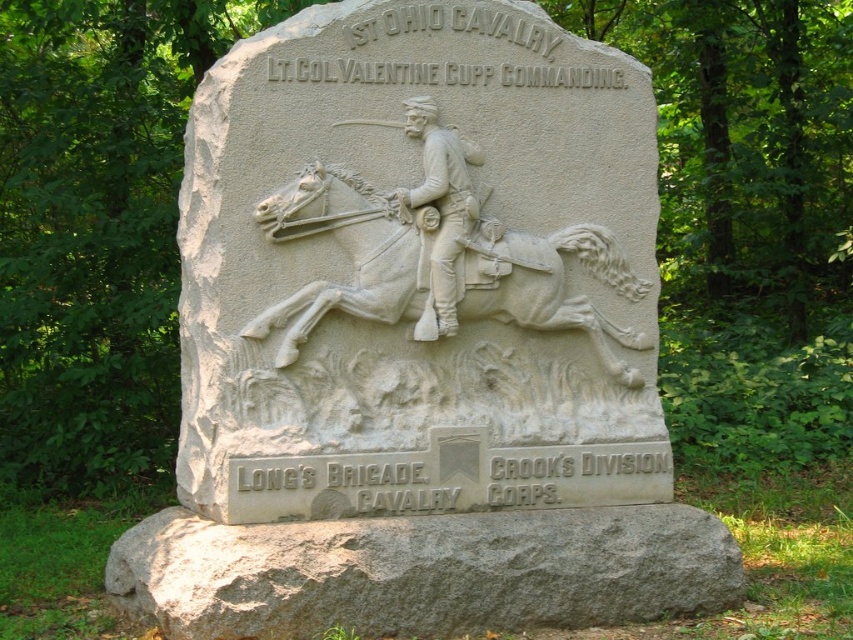
Is point (592, 240) positioned behind point (428, 99)?

Yes, point (592, 240) is behind point (428, 99).

Who is higher up, white stone horse at center or white stone soldier at center?

white stone soldier at center

Is point (518, 260) farther from camera compared to point (410, 196)?

Yes, it is behind point (410, 196).

At what (x,y) coordinates should I click in order to perform the action: click on white stone horse at center. Please return your answer as a coordinate pair (x, y). The width and height of the screenshot is (853, 640). Looking at the image, I should click on (350, 256).

Is point (621, 577) less distant than point (445, 332)?

Yes.

Is point (405, 520) behind point (450, 148)?

No, it is in front of (450, 148).

Identify the location of gray stone base at lower center. The image size is (853, 640). (422, 572).

Between gray stone base at lower center and white stone horse at center, which one appears on the right side from the viewer's perspective?

From the viewer's perspective, gray stone base at lower center appears more on the right side.

Is gray stone base at lower center positioned in front of white stone horse at center?

Yes, gray stone base at lower center is closer to the viewer.

Which is in front, point (610, 577) or point (274, 324)?

Positioned in front is point (274, 324).

In order to click on gray stone base at lower center in this screenshot , I will do `click(422, 572)`.